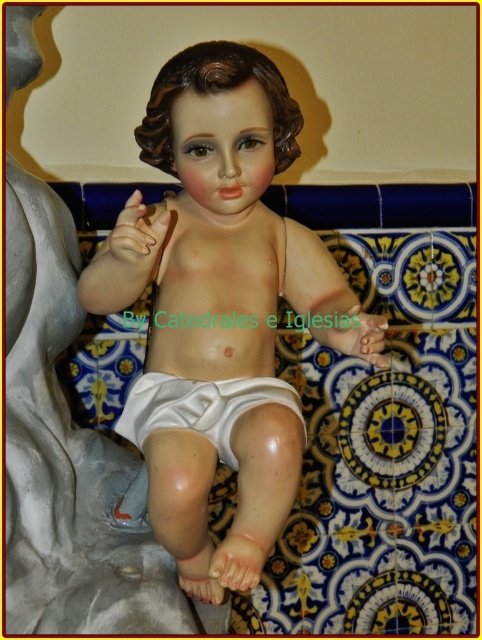
Question: Is smooth porcelain doll at center bigger than white matte hand at lower center?

Choices:
 (A) no
 (B) yes

Answer: (B)

Question: Among these points, which one is nearest to the camera?

Choices:
 (A) pos(130,234)
 (B) pos(377,355)
 (C) pos(152,378)

Answer: (A)

Question: Can you confirm if smooth porcelain doll at center is thinner than matte flesh-toned hand at center?

Choices:
 (A) no
 (B) yes

Answer: (A)

Question: Which object appears closest to the camera in this image?

Choices:
 (A) white cloth diaper at center
 (B) matte flesh-toned hand at center
 (C) smooth porcelain doll at center

Answer: (B)

Question: Does smooth porcelain doll at center come behind matte flesh-toned hand at center?

Choices:
 (A) yes
 (B) no

Answer: (A)

Question: Based on their relative distances, which object is farther from the white matte hand at lower center?

Choices:
 (A) white cloth diaper at center
 (B) smooth porcelain doll at center

Answer: (B)